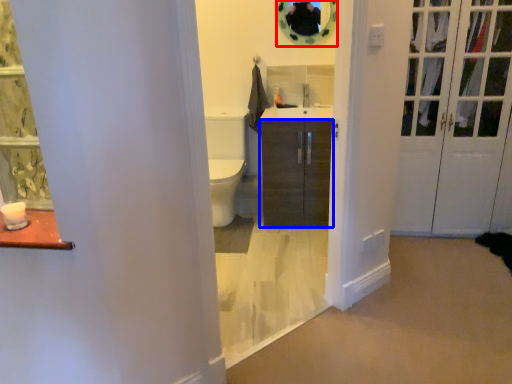
Question: Which object is further to the camera taking this photo, mirror (highlighted by a red box) or cabinetry (highlighted by a blue box)?

Choices:
 (A) mirror
 (B) cabinetry

Answer: (A)